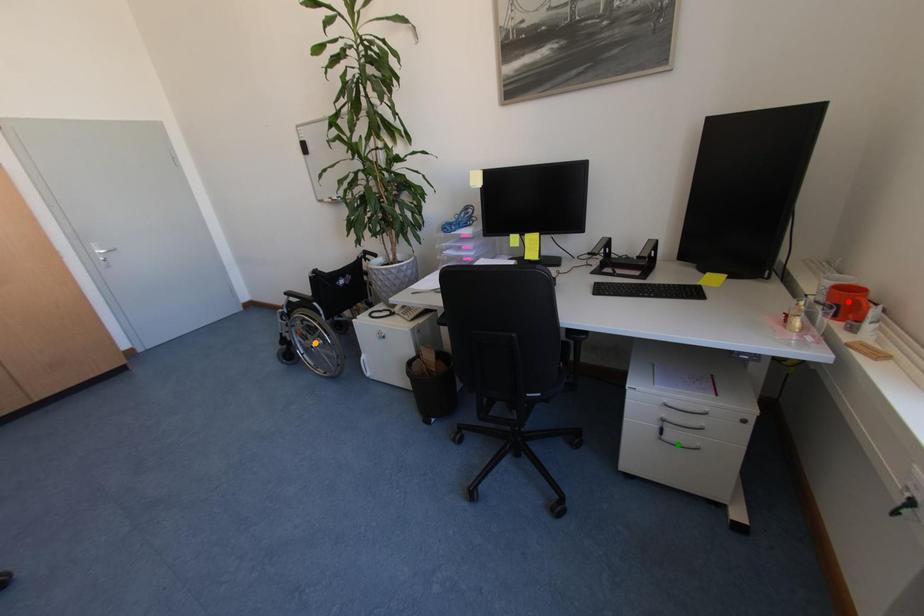
Order these from farthest to nearest:
- orange point
- green point
- red point

orange point
green point
red point